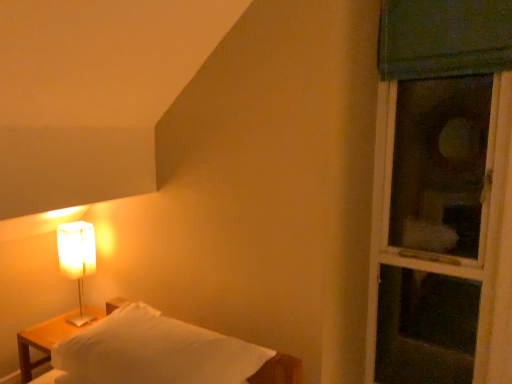
Locate an element on the screen. The width and height of the screenshot is (512, 384). empty space that is ontop of white matte rectangular lamp at left (from a real-world perspective) is located at coordinates (71, 228).